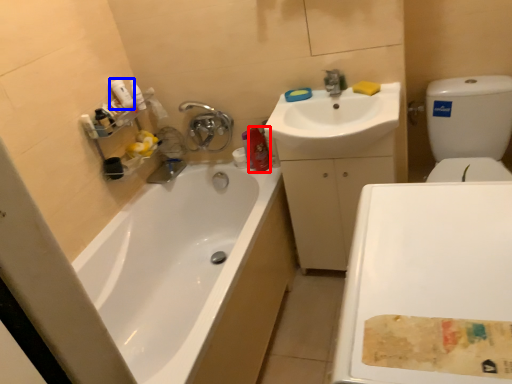
Question: Which point is closer to the camera, cleaning product (highlighted by a red box) or cleaning product (highlighted by a blue box)?

Choices:
 (A) cleaning product
 (B) cleaning product

Answer: (B)